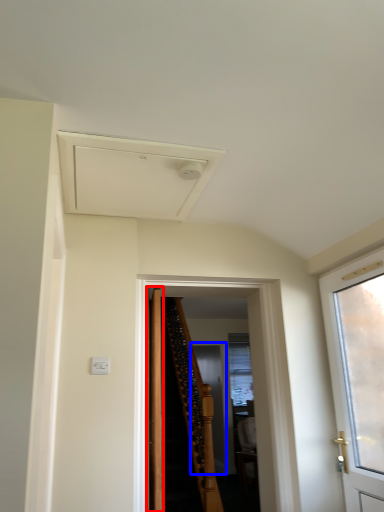
Question: Among these objects, which one is nearest to the camera, door (highlighted by a red box) or screen door (highlighted by a blue box)?

Choices:
 (A) door
 (B) screen door

Answer: (A)